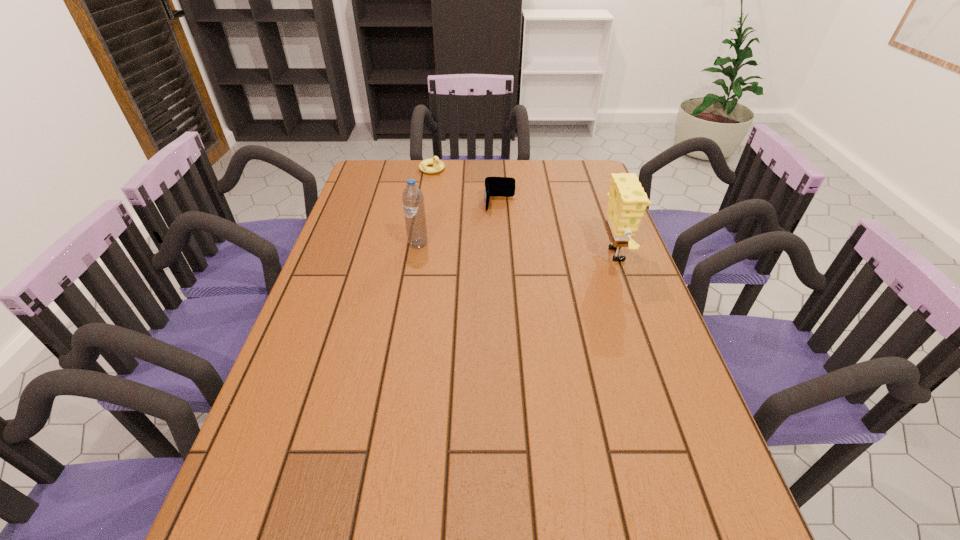
This screenshot has width=960, height=540. Find the location of `free space on the desktop that is between the water bottle and the rightmost object and is positioned on the outer surface of the third nearest object`. free space on the desktop that is between the water bottle and the rightmost object and is positioned on the outer surface of the third nearest object is located at coordinates (502, 248).

You are a GUI agent. You are given a task and a screenshot of the screen. Output one action in this format:
    pyautogui.click(x=<x>, y=<y>)
    Task: Click on the free space on the desktop that is between the water bottle and the rightmost object and is positioned on the face of the duckling
    This screenshot has width=960, height=540.
    Given the screenshot: What is the action you would take?
    pyautogui.click(x=526, y=249)